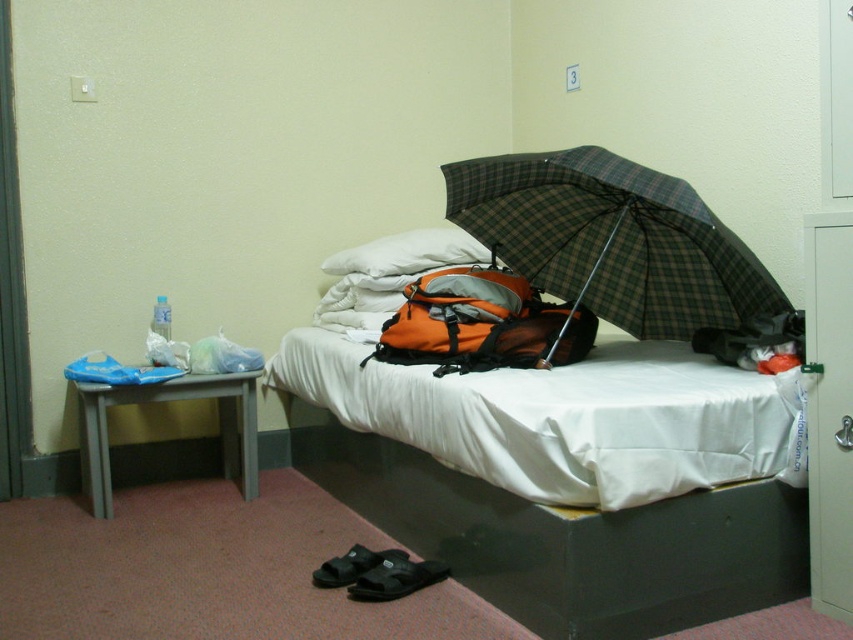
You are standing in the room and want to reach both points. Which point, point (248, 467) or point (354, 582), will you reach first if you move directly toward them?

Point (248, 467) is further to the viewer than point (354, 582), so you will reach point (248, 467) first.

Looking at this image, you need to place a rectangular box that is 30 cm wide on the floor. Which object, the gray plastic stool at lower left or the black fabric sandals at lower center, would you choose to place the box next to without overlapping?

The gray plastic stool at lower left has a larger width than the black fabric sandals at lower center, so placing the box next to the gray plastic stool at lower left would provide more space to avoid overlapping.

You are standing at the camera position in the room. You want to move to the white fabric bed at center. Is the distance between you and the bed sufficient to allow you to walk directly to it without needing to navigate around any obstacles?

The distance between you and the white fabric bed at center is 5.91 feet, which is sufficient to walk directly to it without needing to navigate around obstacles.